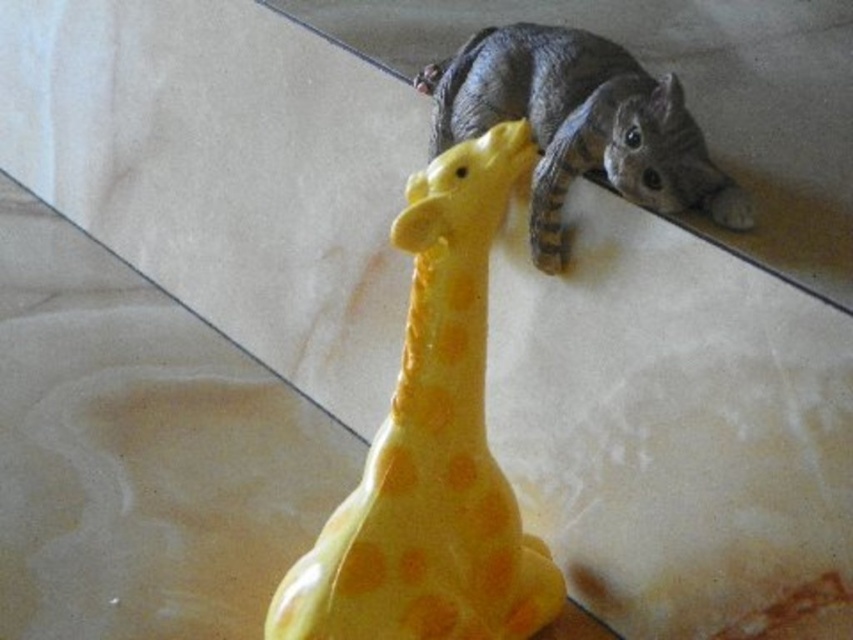
Question: Can you confirm if yellow rubber giraffe at center is positioned below gray fur cat at upper right?

Choices:
 (A) yes
 (B) no

Answer: (A)

Question: Which point is farther from the camera taking this photo?

Choices:
 (A) (393, 236)
 (B) (634, 186)

Answer: (B)

Question: Which point is farther from the camera taking this photo?

Choices:
 (A) (465, 129)
 (B) (465, 148)

Answer: (A)

Question: Is yellow rubber giraffe at center bigger than gray fur cat at upper right?

Choices:
 (A) yes
 (B) no

Answer: (A)

Question: Is yellow rubber giraffe at center thinner than gray fur cat at upper right?

Choices:
 (A) yes
 (B) no

Answer: (A)